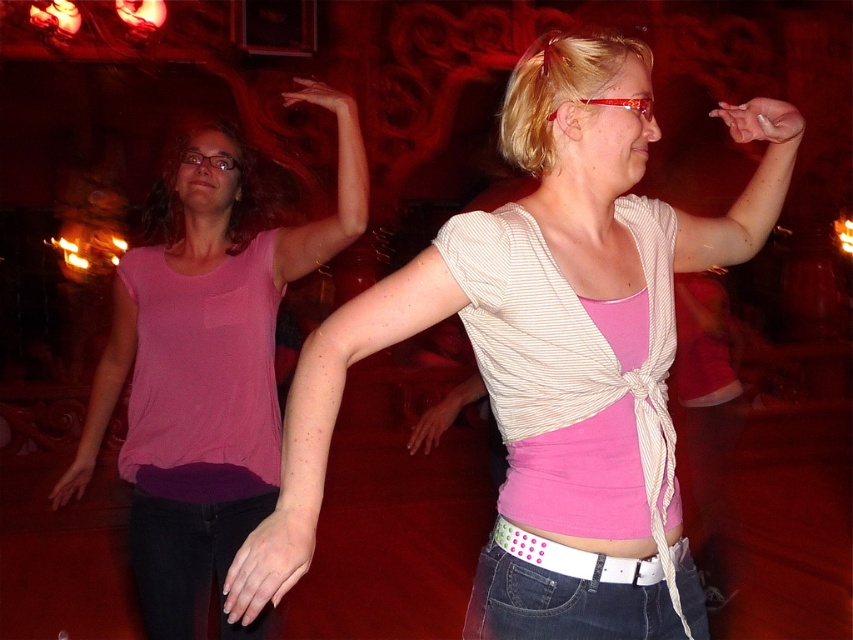
Question: Estimate the real-world distances between objects in this image. Which object is closer to the pink fabric shirt at left?

Choices:
 (A) denim jeans at lower center
 (B) pink striped shirt at center

Answer: (B)

Question: Which point appears closest to the camera in this image?

Choices:
 (A) (183, 531)
 (B) (541, 541)
 (C) (631, 556)

Answer: (B)

Question: Can you confirm if pink striped shirt at center is thinner than pink fabric shirt at left?

Choices:
 (A) no
 (B) yes

Answer: (A)

Question: Observing the image, what is the correct spatial positioning of denim jeans at lower center in reference to black denim jeans at lower left?

Choices:
 (A) above
 (B) below

Answer: (A)

Question: Which of the following is the farthest from the observer?

Choices:
 (A) (630, 522)
 (B) (527, 604)
 (C) (265, 512)
 (D) (132, 529)

Answer: (C)

Question: Can you confirm if pink fabric shirt at left is positioned to the right of black denim jeans at lower left?

Choices:
 (A) yes
 (B) no

Answer: (B)